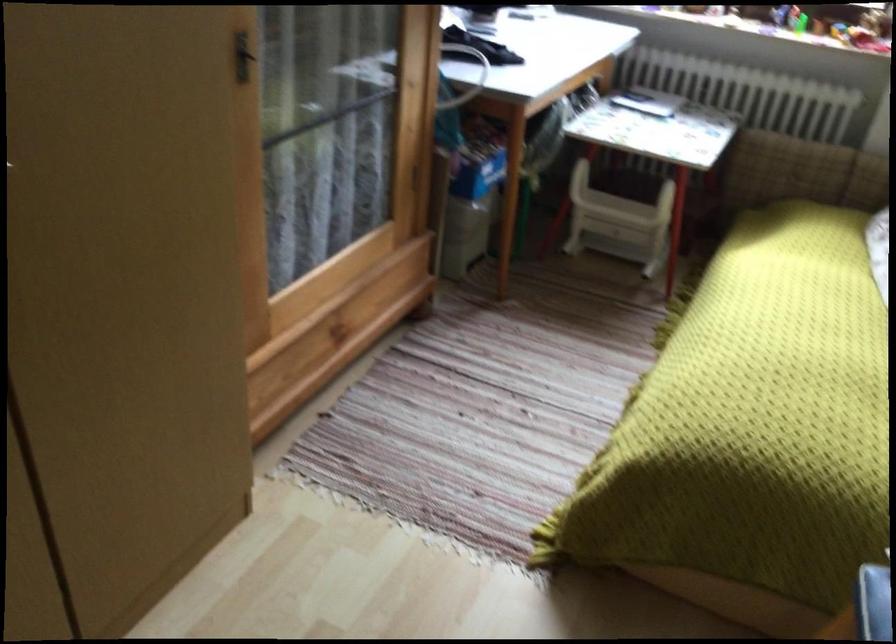
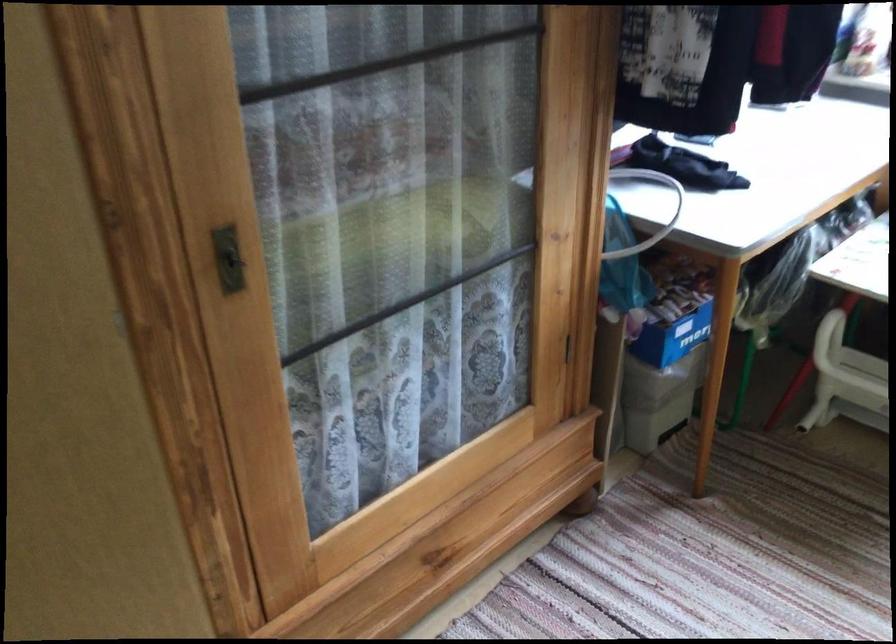
In a continuous first-person perspective shot, in which direction is the camera moving?

The cameraman moved toward right, forward.